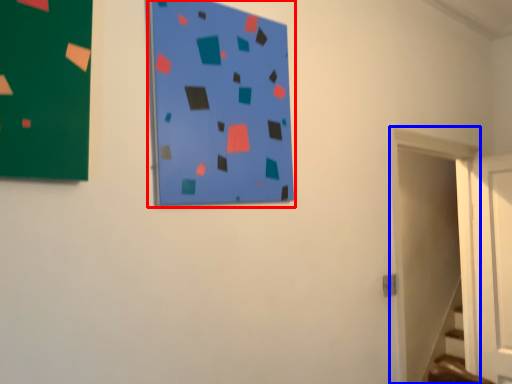
Question: Among these objects, which one is farthest to the camera, bulletin board (highlighted by a red box) or door (highlighted by a blue box)?

Choices:
 (A) bulletin board
 (B) door

Answer: (B)